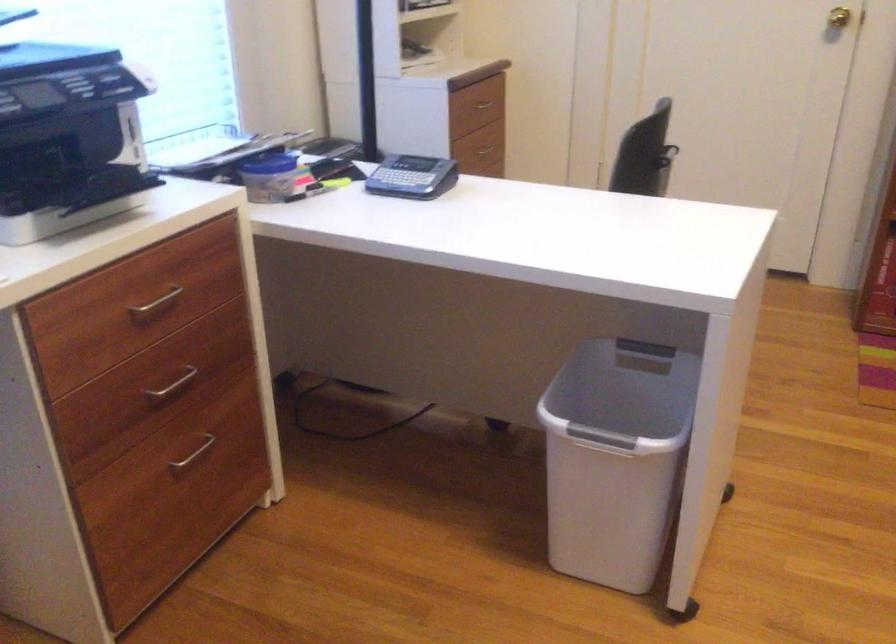
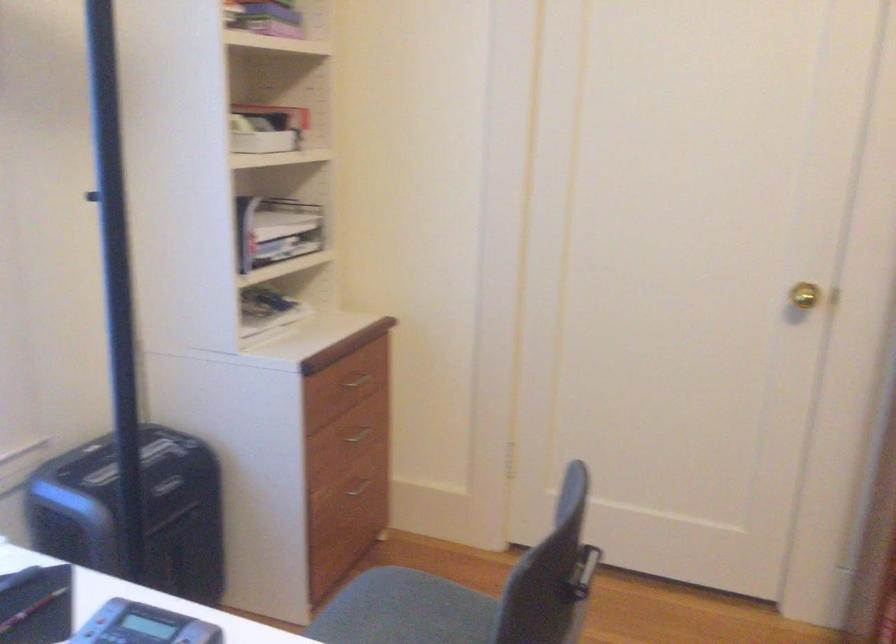
Question: The first image is from the beginning of the video and the second image is from the end. How did the camera likely rotate when shooting the video?

Choices:
 (A) Left
 (B) Right
 (C) Up
 (D) Down

Answer: (C)